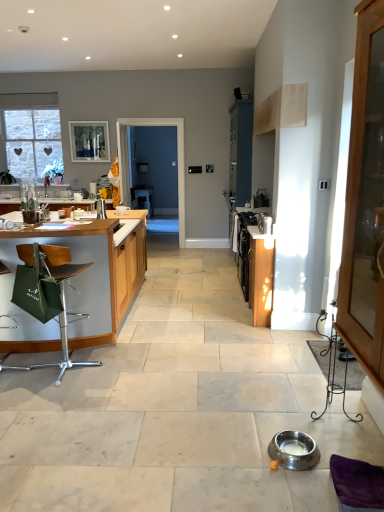
Question: Based on their sizes in the image, would you say purple fabric swivel chair at lower right is bigger or smaller than matte glass window screen at upper left?

Choices:
 (A) big
 (B) small

Answer: (B)

Question: In terms of height, does purple fabric swivel chair at lower right look taller or shorter compared to matte glass window screen at upper left?

Choices:
 (A) tall
 (B) short

Answer: (B)

Question: Estimate the real-world distances between objects in this image. Which object is farther from the green leather chair at left?

Choices:
 (A) green fabric table at left
 (B) transparent glass screen door at center
 (C) stainless steel bowl at lower center, marked as the second appliance in a back-to-front arrangement
 (D) light wood cabinet at right, the 2th cabinetry viewed from the back
 (E) wooden cabinet at right, the second cabinetry when ordered from front to back

Answer: (B)

Question: Estimate the real-world distances between objects in this image. Which object is closer to the matte glass window screen at upper left?

Choices:
 (A) green leather chair at left
 (B) purple fabric swivel chair at lower right
 (C) stainless steel bowl at lower center, marked as the second appliance in a back-to-front arrangement
 (D) light wood cabinet at right, which is the first cabinetry from front to back
 (E) satin silver kettle at center-right, marked as the second appliance in a front-to-back arrangement

Answer: (E)